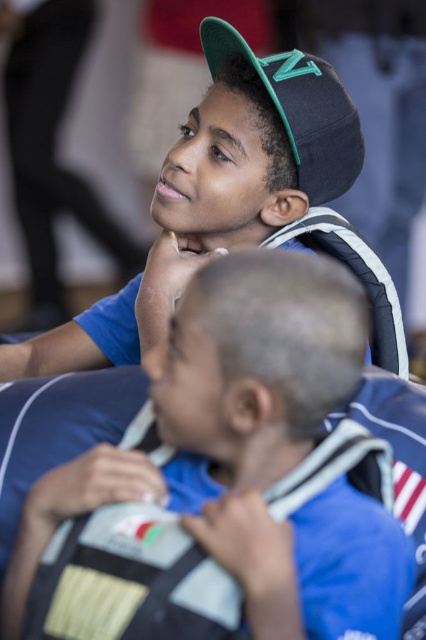
Question: Is matte black cap at upper center bigger than black matte baseball cap at upper center?

Choices:
 (A) no
 (B) yes

Answer: (B)

Question: Which of the following is the farthest from the observer?

Choices:
 (A) matte black cap at upper center
 (B) black matte baseball cap at upper center
 (C) blue fabric shirt at center

Answer: (A)

Question: Is the position of matte black cap at upper center more distant than that of black matte baseball cap at upper center?

Choices:
 (A) no
 (B) yes

Answer: (B)

Question: Does blue fabric shirt at center appear over matte black cap at upper center?

Choices:
 (A) yes
 (B) no

Answer: (B)

Question: Based on their relative distances, which object is farther from the matte black cap at upper center?

Choices:
 (A) black matte baseball cap at upper center
 (B) blue fabric shirt at center

Answer: (B)

Question: Which object is closer to the camera taking this photo?

Choices:
 (A) black matte baseball cap at upper center
 (B) blue fabric shirt at center

Answer: (B)